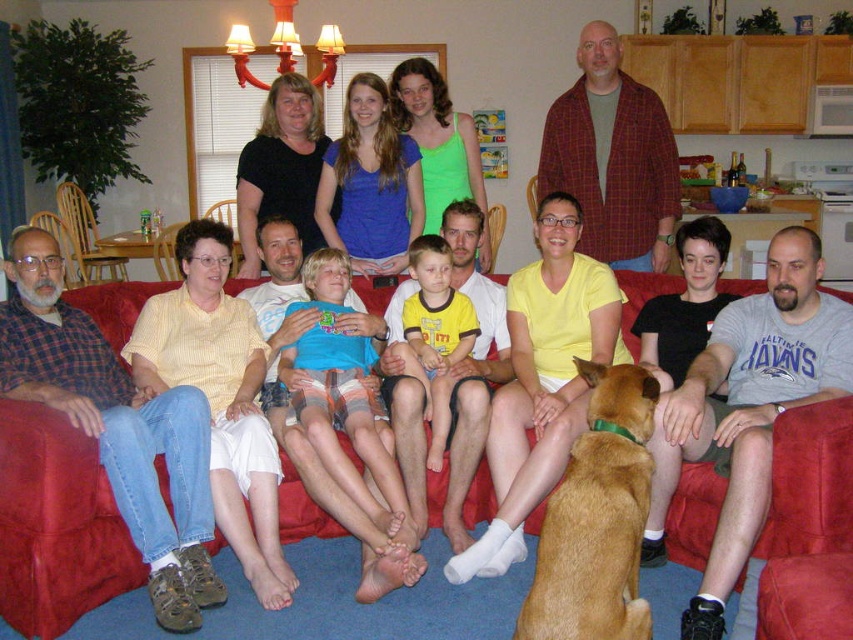
Question: Does gray cotton t-shirt at center appear over yellow t-shirt at center?

Choices:
 (A) no
 (B) yes

Answer: (A)

Question: Which of these objects is positioned farthest from the yellow t-shirt at center?

Choices:
 (A) plaid flannel shirt at left
 (B) yellow matte shirt at center

Answer: (A)

Question: Which is farther from the yellow matte shirt at center?

Choices:
 (A) red fabric couch at center
 (B) brown furry dog at lower center

Answer: (A)

Question: Among these points, which one is nearest to the camera?

Choices:
 (A) (494, 515)
 (B) (341, 358)
 (C) (846, 506)
 (D) (610, 228)

Answer: (C)

Question: Does yellow matte shirt at center have a smaller size compared to yellow t-shirt at center?

Choices:
 (A) no
 (B) yes

Answer: (A)

Question: Does plaid flannel shirt at left lie in front of yellow matte shirt at center?

Choices:
 (A) no
 (B) yes

Answer: (B)